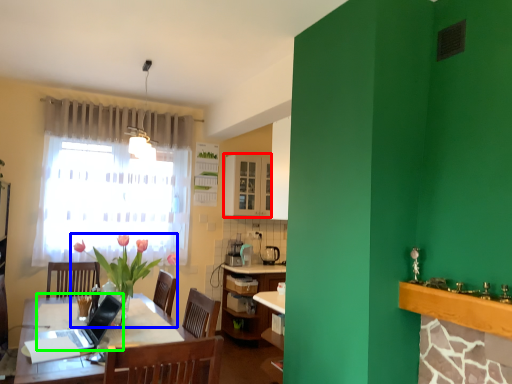
Question: Based on their relative distances, which object is farther from cabinetry (highlighted by a red box)? Choose from houseplant (highlighted by a blue box) and laptop (highlighted by a green box).

Choices:
 (A) houseplant
 (B) laptop

Answer: (B)